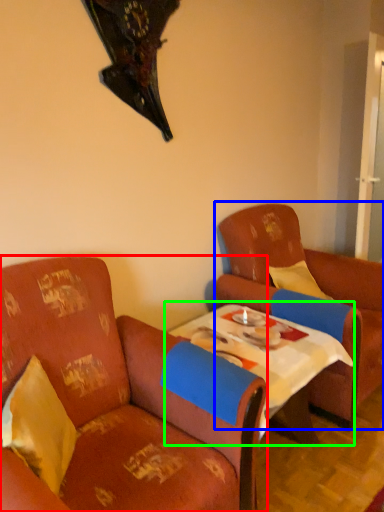
Question: Estimate the real-world distances between objects in this image. Which object is farther from chair (highlighted by a red box), chair (highlighted by a blue box) or table (highlighted by a green box)?

Choices:
 (A) chair
 (B) table

Answer: (A)